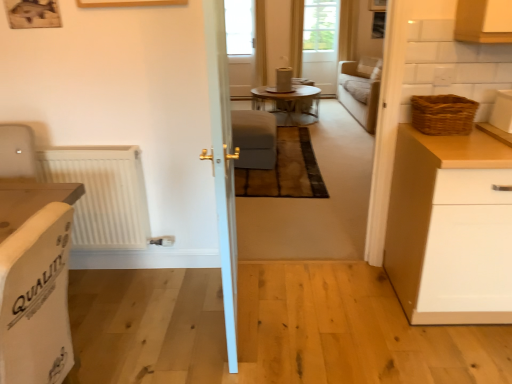
The image size is (512, 384). I want to click on suede-like beige armchair at center, the first armchair when ordered from right to left, so click(x=254, y=139).

Describe the element at coordinates (254, 139) in the screenshot. The height and width of the screenshot is (384, 512). I see `suede-like beige armchair at center, acting as the 2th armchair starting from the front` at that location.

What is the approximate width of white matte cabinet at right?

The width of white matte cabinet at right is 26.95 inches.

The image size is (512, 384). What do you see at coordinates (321, 43) in the screenshot? I see `translucent glass screen door at upper center` at bounding box center [321, 43].

Find the location of a particular element. woven brown basket at right is located at coordinates (443, 114).

From their relative heights in the image, would you say white glossy door at center is taller or shorter than wooden glass table at center?

In the image, white glossy door at center appears to be taller than wooden glass table at center.

Is wooden glass table at center completely or partially inside white glossy door at center?

Actually, wooden glass table at center is outside white glossy door at center.

From the picture: Which of these two, white glossy door at center or wooden glass table at center, is bigger?

With larger size is wooden glass table at center.

What's the angular difference between white glossy container at upper right, arranged as the second appliance when viewed from the top, and woven brown basket at right's facing directions?

1.99 degrees.

Consider the image. From a real-world perspective, who is located higher, white glossy container at upper right, which is the 2th appliance in left-to-right order, or woven brown basket at right?

From a 3D spatial view, white glossy container at upper right, which is the 2th appliance in left-to-right order, is above.

Considering the sizes of objects white glossy container at upper right, acting as the 1th appliance starting from the front, and woven brown basket at right in the image provided, who is smaller, white glossy container at upper right, acting as the 1th appliance starting from the front, or woven brown basket at right?

white glossy container at upper right, acting as the 1th appliance starting from the front, is smaller.

From the image's perspective, is translucent glass screen door at upper center located above or below transparent glass window at center?

translucent glass screen door at upper center is below transparent glass window at center.

Which of these two, translucent glass screen door at upper center or transparent glass window at center, stands shorter?

With less height is transparent glass window at center.

Considering the positions of point (331, 3) and point (232, 47), is point (331, 3) closer or farther from the camera than point (232, 47)?

Clearly, point (331, 3) is closer to the camera than point (232, 47).

Who is bigger, white fabric armchair at left, which is the second armchair in back-to-front order, or matte cardboard cylinder at center, marked as the first appliance in a back-to-front arrangement?

white fabric armchair at left, which is the second armchair in back-to-front order.

From the image's perspective, which one is positioned higher, white fabric armchair at left, which is the first armchair from front to back, or matte cardboard cylinder at center, marked as the first appliance in a back-to-front arrangement?

matte cardboard cylinder at center, marked as the first appliance in a back-to-front arrangement, from the image's perspective.

Based on the photo, is white fabric armchair at left, the second armchair when ordered from top to bottom, wider or thinner than matte cardboard cylinder at center, marked as the first appliance in a back-to-front arrangement?

white fabric armchair at left, the second armchair when ordered from top to bottom, is wider than matte cardboard cylinder at center, marked as the first appliance in a back-to-front arrangement.

How far apart are suede-like beige armchair at center, which ranks as the 1th armchair in back-to-front order, and transparent glass window at center?

3.32 meters.

How many degrees apart are the facing directions of suede-like beige armchair at center, the second armchair in the left-to-right sequence, and transparent glass window at center?

They differ by 1.22 degrees in their facing directions.

Based on the photo, are suede-like beige armchair at center, the second armchair in the left-to-right sequence, and transparent glass window at center located far from each other?

Yes.

From the image's perspective, who appears lower, suede-like beige armchair at center, the 2th armchair positioned from the bottom, or transparent glass window at center?

suede-like beige armchair at center, the 2th armchair positioned from the bottom, appears lower in the image.

Is suede-like beige armchair at center, the 2th armchair positioned from the bottom, to the right of translucent glass screen door at upper center from the viewer's perspective?

Incorrect, suede-like beige armchair at center, the 2th armchair positioned from the bottom, is not on the right side of translucent glass screen door at upper center.

Which of these two, suede-like beige armchair at center, acting as the 2th armchair starting from the front, or translucent glass screen door at upper center, is bigger?

Bigger between the two is translucent glass screen door at upper center.

Considering the relative positions of suede-like beige armchair at center, acting as the 2th armchair starting from the front, and translucent glass screen door at upper center in the image provided, is suede-like beige armchair at center, acting as the 2th armchair starting from the front, in front of translucent glass screen door at upper center?

Yes, the depth of suede-like beige armchair at center, acting as the 2th armchair starting from the front, is less than that of translucent glass screen door at upper center.

From the image's perspective, which is above, suede-like beige armchair at center, the second armchair in the left-to-right sequence, or translucent glass screen door at upper center?

translucent glass screen door at upper center.

Is matte cardboard cylinder at center, the second appliance from the bottom, surrounding suede-like beige armchair at center, which is counted as the 1th armchair, starting from the top?

No.

Is the depth of matte cardboard cylinder at center, acting as the second appliance starting from the front, less than that of suede-like beige armchair at center, the second armchair in the left-to-right sequence?

No.

You are a GUI agent. You are given a task and a screenshot of the screen. Output one action in this format:
    pyautogui.click(x=<x>, y=<y>)
    Task: Click on the armchair that is the 2nd object directly below the matte cardboard cylinder at center, positioned as the 2th appliance in right-to-left order (from a real-world perspective)
    
    Given the screenshot: What is the action you would take?
    pyautogui.click(x=254, y=139)

What's the angular difference between matte cardboard cylinder at center, marked as the first appliance in a left-to-right arrangement, and suede-like beige armchair at center, the first armchair when ordered from right to left,'s facing directions?

The angle between the facing direction of matte cardboard cylinder at center, marked as the first appliance in a left-to-right arrangement, and the facing direction of suede-like beige armchair at center, the first armchair when ordered from right to left, is 0.00465 degrees.

The image size is (512, 384). Find the location of `door that appears on the left of wooden glass table at center`. door that appears on the left of wooden glass table at center is located at coordinates (222, 166).

Find the location of a particular element. This screenshot has height=384, width=512. appliance that is above the woven brown basket at right (from a real-world perspective) is located at coordinates (502, 111).

Based on their spatial positions, is wooden glass table at center or white fabric armchair at left, which ranks as the first armchair in bottom-to-top order, further from white ribbed radiator at left?

Based on the image, wooden glass table at center appears to be further to white ribbed radiator at left.

Which object lies further to the anchor point translucent glass screen door at upper center, matte cardboard cylinder at center, positioned as the 2th appliance in right-to-left order, or suede-like beige armchair at center, the second armchair in the left-to-right sequence?

suede-like beige armchair at center, the second armchair in the left-to-right sequence.

Based on their spatial positions, is matte cardboard cylinder at center, marked as the first appliance in a left-to-right arrangement, or white fabric armchair at left, the second armchair when ordered from top to bottom, further from white matte cabinet at right?

matte cardboard cylinder at center, marked as the first appliance in a left-to-right arrangement, is positioned further to the anchor white matte cabinet at right.

Looking at the image, which one is located further to translucent glass screen door at upper center, woven brown basket at right or white matte cabinet at right?

Among the two, white matte cabinet at right is located further to translucent glass screen door at upper center.

From the image, which object appears to be nearer to white ribbed radiator at left, white glossy door at center or translucent glass screen door at upper center?

The object closer to white ribbed radiator at left is white glossy door at center.

From the image, which object appears to be farther from woven brown basket at right, white glossy door at center or white fabric armchair at left, which is the second armchair in back-to-front order?

Based on the image, white fabric armchair at left, which is the second armchair in back-to-front order, appears to be further to woven brown basket at right.

From the image, which object appears to be farther from white glossy door at center, white fabric armchair at left, which is the first armchair from front to back, or woven brown basket at right?

woven brown basket at right.

Considering their positions, is white glossy container at upper right, acting as the 1th appliance starting from the front, positioned further to wooden glass table at center than transparent glass window at center?

Among the two, white glossy container at upper right, acting as the 1th appliance starting from the front, is located further to wooden glass table at center.

I want to click on armchair positioned between white fabric armchair at left, which is the first armchair from front to back, and transparent glass window at center from near to far, so click(x=254, y=139).

This screenshot has height=384, width=512. In order to click on radiator between white matte cabinet at right and transparent glass window at center in the front-back direction in this screenshot , I will do `click(103, 194)`.

Locate an element on the screen. table between white ribbed radiator at left and matte cardboard cylinder at center, marked as the first appliance in a left-to-right arrangement, along the z-axis is located at coordinates (290, 103).

Identify the location of table positioned between white glossy container at upper right, positioned as the second appliance in back-to-front order, and matte cardboard cylinder at center, acting as the second appliance starting from the front, from near to far. (290, 103).